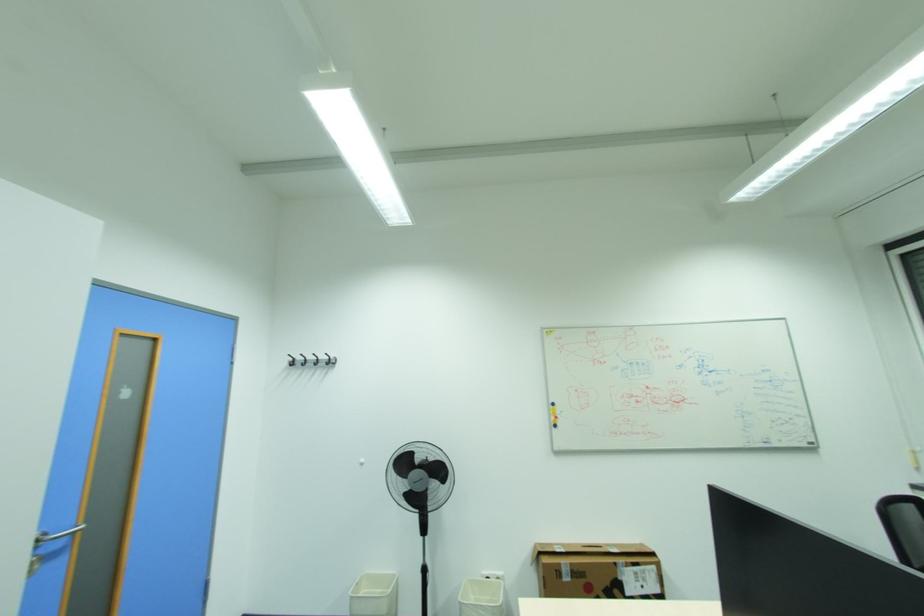
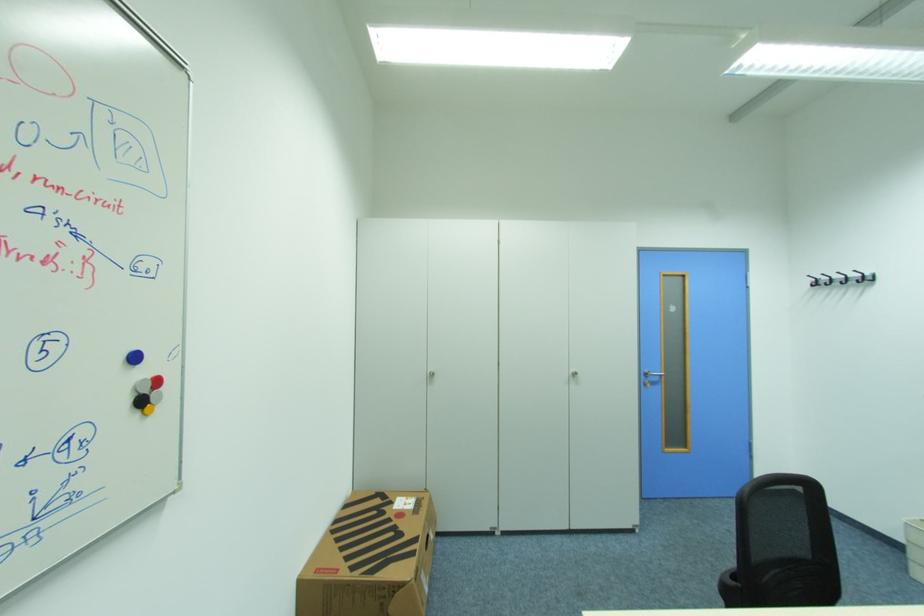
The point at (337, 359) is marked in the first image. Where is the corresponding point in the second image?

(872, 275)